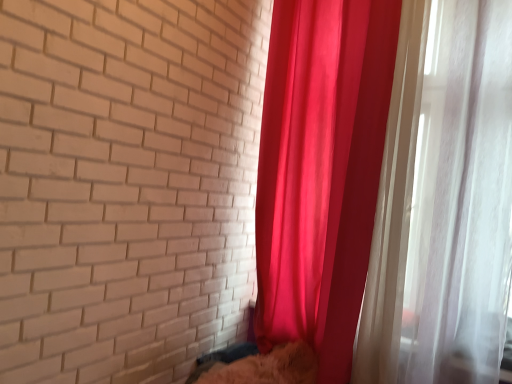
Question: Could you tell me if silky red curtain at right is turned towards fuzzy beige cat at lower center?

Choices:
 (A) yes
 (B) no

Answer: (B)

Question: Is silky red curtain at right thinner than fuzzy beige cat at lower center?

Choices:
 (A) no
 (B) yes

Answer: (B)

Question: Is the depth of silky red curtain at right greater than that of fuzzy beige cat at lower center?

Choices:
 (A) no
 (B) yes

Answer: (A)

Question: Are silky red curtain at right and fuzzy beige cat at lower center located far from each other?

Choices:
 (A) no
 (B) yes

Answer: (A)

Question: Does silky red curtain at right appear on the left side of fuzzy beige cat at lower center?

Choices:
 (A) yes
 (B) no

Answer: (B)

Question: From the image's perspective, is silky red curtain at right over fuzzy beige cat at lower center?

Choices:
 (A) yes
 (B) no

Answer: (A)

Question: Does fuzzy beige cat at lower center come in front of silky red curtain at right?

Choices:
 (A) no
 (B) yes

Answer: (A)

Question: Would you say fuzzy beige cat at lower center is outside silky red curtain at right?

Choices:
 (A) yes
 (B) no

Answer: (A)

Question: Is fuzzy beige cat at lower center next to silky red curtain at right?

Choices:
 (A) yes
 (B) no

Answer: (B)

Question: Can you confirm if fuzzy beige cat at lower center is thinner than silky red curtain at right?

Choices:
 (A) no
 (B) yes

Answer: (A)

Question: Does fuzzy beige cat at lower center have a greater width compared to silky red curtain at right?

Choices:
 (A) no
 (B) yes

Answer: (B)

Question: Does fuzzy beige cat at lower center have a smaller size compared to silky red curtain at right?

Choices:
 (A) no
 (B) yes

Answer: (B)

Question: Is fuzzy beige cat at lower center inside or outside of silky red curtain at right?

Choices:
 (A) outside
 (B) inside

Answer: (A)